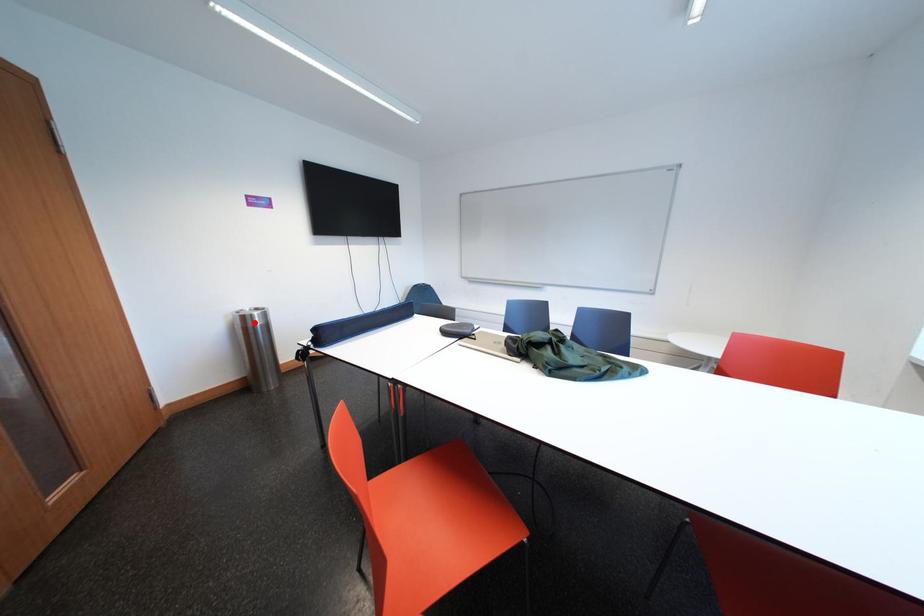
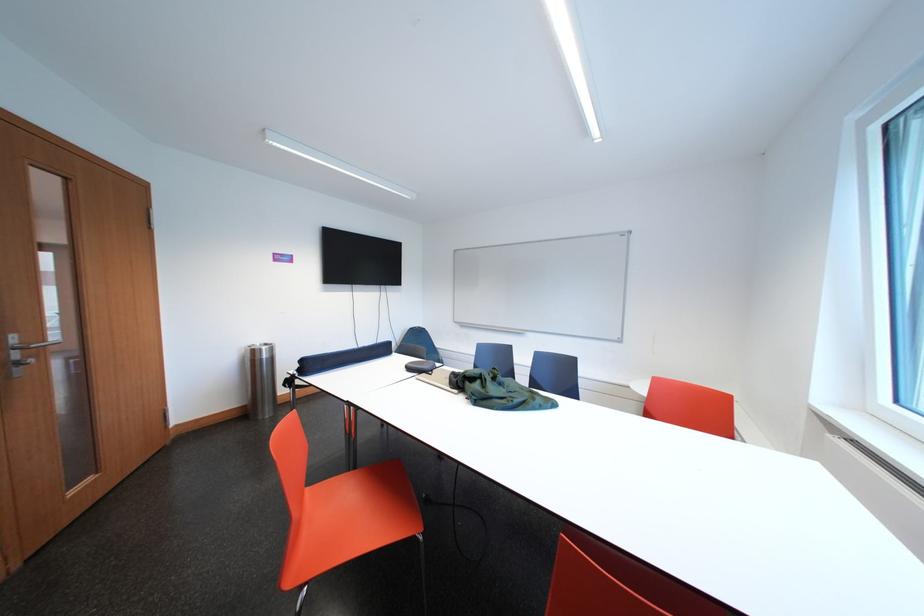
Locate, in the second image, the point that corresponds to the highlighted location in the first image.

(263, 357)